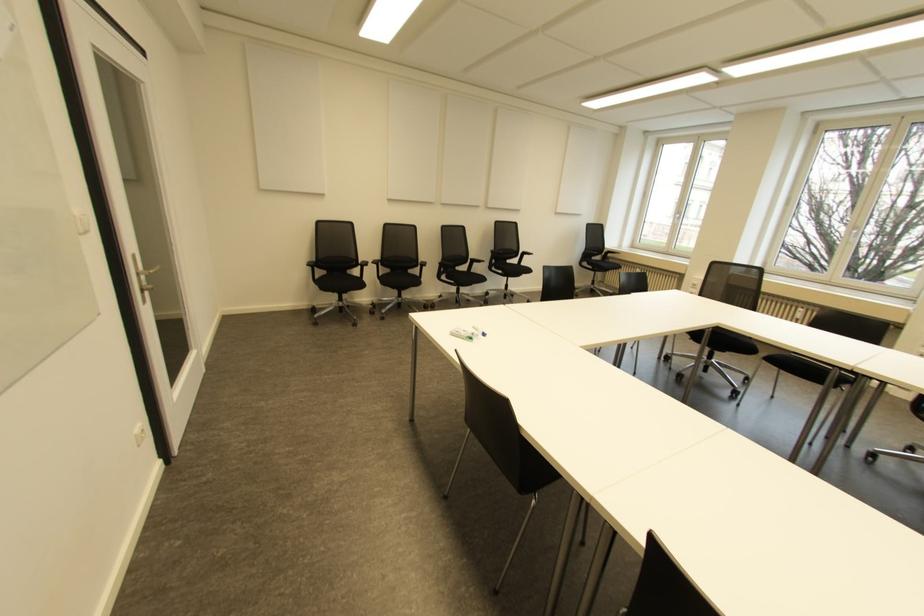
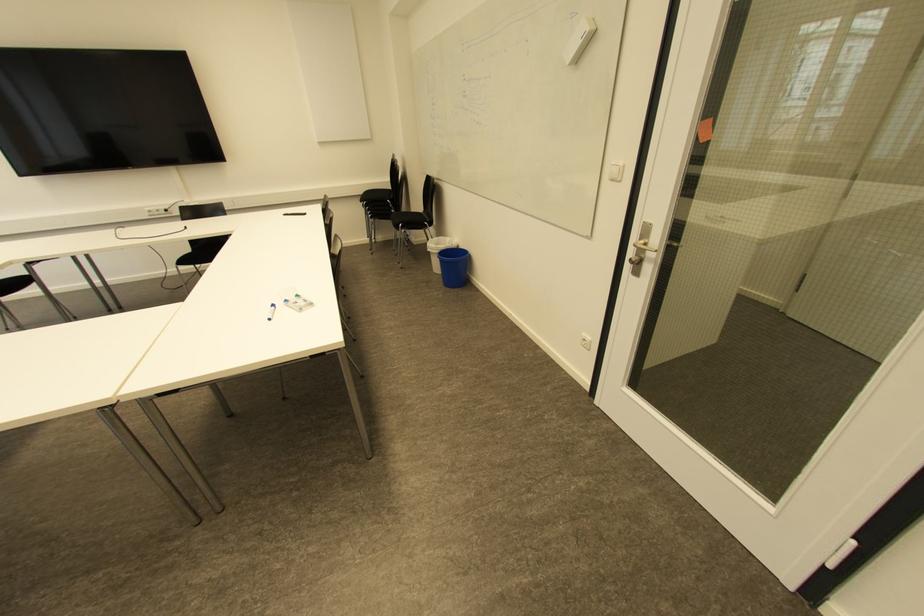
Where in the second image is the point corresponding to pixel 483 334 from the first image?

(273, 306)